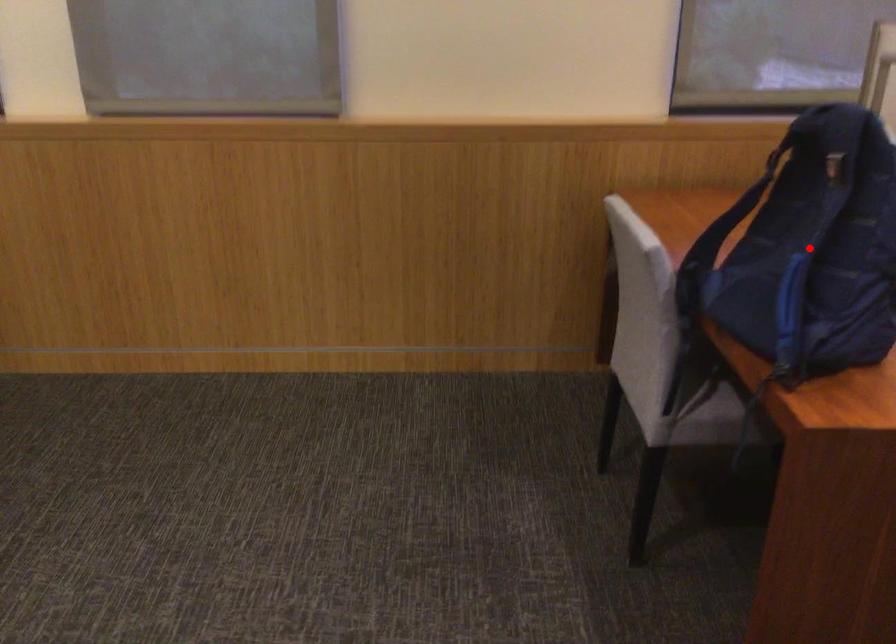
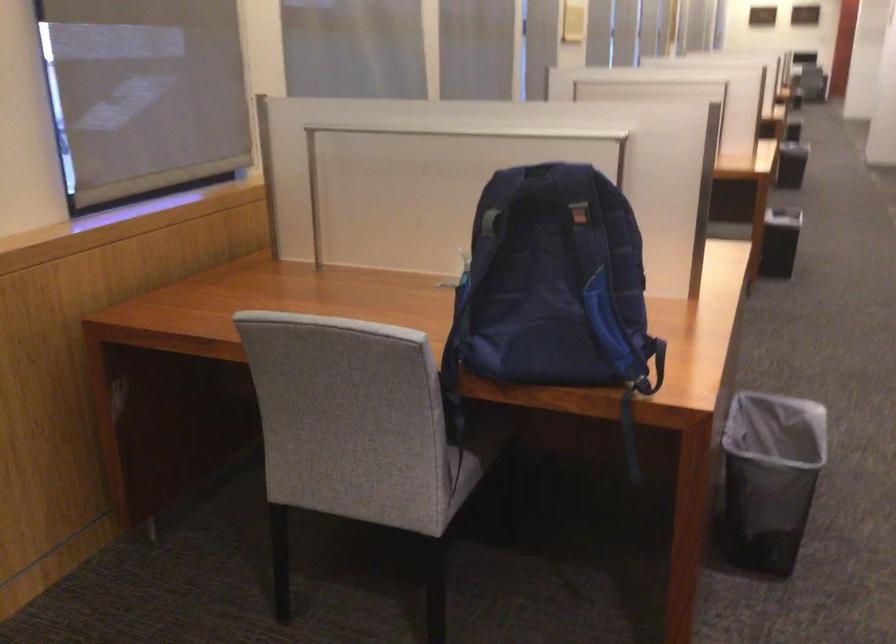
Question: A red point is marked in image1. In image2, is the corresponding 3D point closer to the camera or farther? Reply with the corresponding letter.

Choices:
 (A) The corresponding 3D point is closer.
 (B) The corresponding 3D point is farther.

Answer: (B)